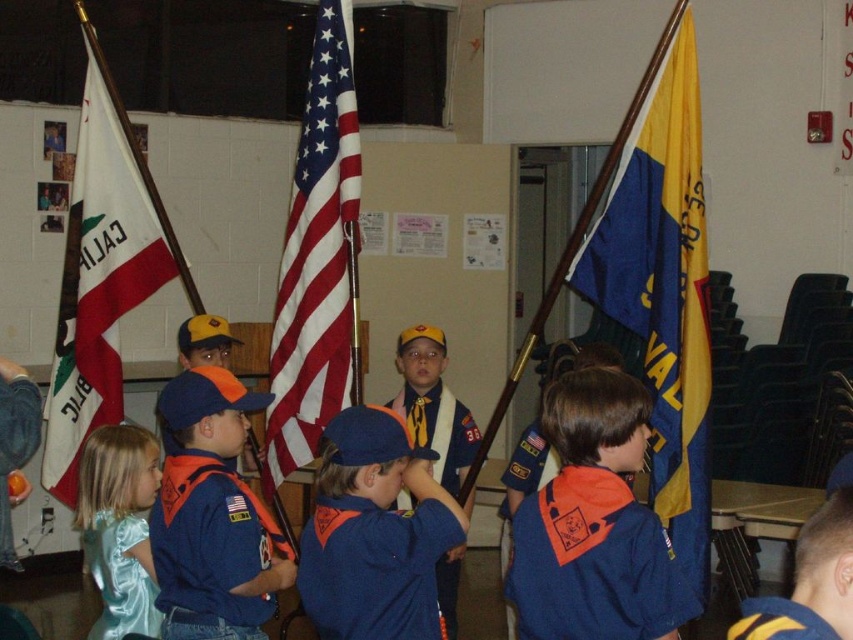
Question: Is blue cotton shirt at center bigger than blue fabric uniform at center?

Choices:
 (A) yes
 (B) no

Answer: (B)

Question: Considering the real-world distances, which object is closest to the blue cotton shirt at center?

Choices:
 (A) blue fabric uniform at center
 (B) blue fleece jacket at center

Answer: (B)

Question: Is blue fleece jacket at center positioned in front of silky blue dress at lower left?

Choices:
 (A) no
 (B) yes

Answer: (B)

Question: Does blue cotton shirt at center have a larger size compared to blue polyester uniform at center?

Choices:
 (A) yes
 (B) no

Answer: (B)

Question: Among these objects, which one is nearest to the camera?

Choices:
 (A) american flag at center
 (B) blue/yellow fabric flag at right

Answer: (B)

Question: Among these points, which one is nearest to the camera?

Choices:
 (A) (355, 243)
 (B) (795, 628)
 (C) (82, 486)
 (D) (392, 576)

Answer: (B)